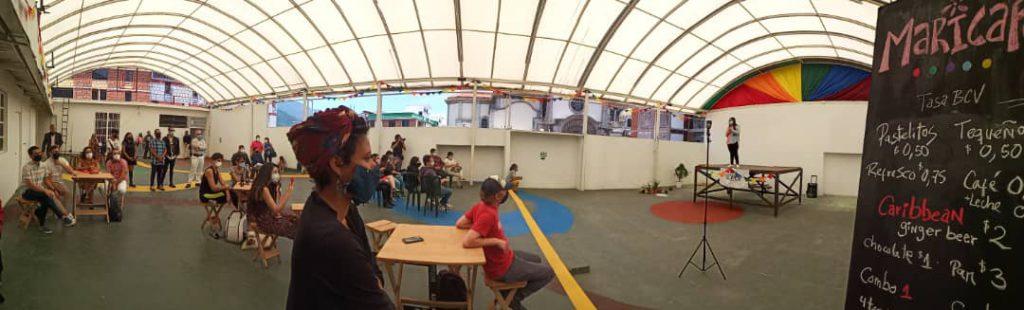
Image resolution: width=1024 pixels, height=310 pixels. I want to click on windows, so click(x=125, y=79), click(x=126, y=96), click(x=292, y=112), click(x=367, y=97), click(x=418, y=123), click(x=501, y=120), click(x=560, y=112), click(x=632, y=124), click(x=693, y=129).